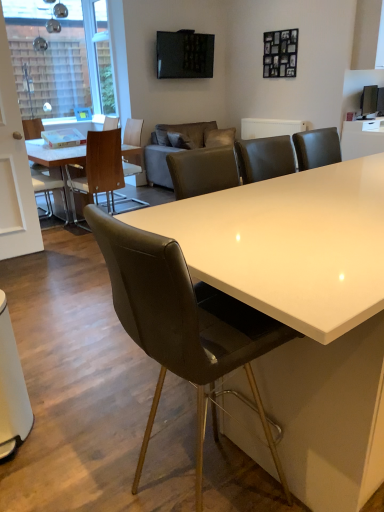
Question: Does woodenchair at left, arranged as the 1th chair when viewed from the back, lie in front of white leather chair at left, arranged as the 2th chair when viewed from the back?

Choices:
 (A) no
 (B) yes

Answer: (A)

Question: Is woodenchair at left, arranged as the 1th chair when viewed from the back, shorter than white leather chair at left, arranged as the 2th chair when viewed from the back?

Choices:
 (A) no
 (B) yes

Answer: (A)

Question: Can you confirm if woodenchair at left, arranged as the 1th chair when viewed from the back, is wider than white leather chair at left, arranged as the 2th chair when viewed from the back?

Choices:
 (A) yes
 (B) no

Answer: (A)

Question: From the image's perspective, does woodenchair at left, arranged as the 1th chair when viewed from the back, appear higher than white leather chair at left, which appears as the third chair when viewed from the front?

Choices:
 (A) yes
 (B) no

Answer: (A)

Question: Is woodenchair at left, arranged as the 1th chair when viewed from the back, at the left side of white leather chair at left, arranged as the 2th chair when viewed from the back?

Choices:
 (A) no
 (B) yes

Answer: (A)

Question: Is leather at center, the 1th chair from the front, inside the boundaries of white glossy table at upper right, which is the 1th table from right to left, or outside?

Choices:
 (A) inside
 (B) outside

Answer: (B)

Question: Considering the positions of leather at center, placed as the fourth chair when sorted from back to front, and white glossy table at upper right, which is the second table in left-to-right order, in the image, is leather at center, placed as the fourth chair when sorted from back to front, taller or shorter than white glossy table at upper right, which is the second table in left-to-right order,?

Choices:
 (A) tall
 (B) short

Answer: (A)

Question: Considering their positions, is leather at center, the 1th chair from the front, located in front of or behind white glossy table at upper right, which is the second table in left-to-right order?

Choices:
 (A) front
 (B) behind

Answer: (A)

Question: Looking at their shapes, would you say leather at center, the 1th chair from the front, is wider or thinner than white glossy table at upper right, which is the 1th table from right to left?

Choices:
 (A) wide
 (B) thin

Answer: (B)

Question: Is matte gray couch at center in front of or behind wooden chair at left, the second chair viewed from the front, in the image?

Choices:
 (A) behind
 (B) front

Answer: (A)

Question: Based on their sizes in the image, would you say matte gray couch at center is bigger or smaller than wooden chair at left, the 3th chair positioned from the back?

Choices:
 (A) big
 (B) small

Answer: (A)

Question: From a real-world perspective, is matte gray couch at center above or below wooden chair at left, the 3th chair positioned from the back?

Choices:
 (A) below
 (B) above

Answer: (A)

Question: Is matte gray couch at center inside or outside of wooden chair at left, the 3th chair positioned from the back?

Choices:
 (A) outside
 (B) inside

Answer: (A)

Question: Is wooden chair at left, the 3th chair positioned from the back, spatially inside white glossy door at left, or outside of it?

Choices:
 (A) outside
 (B) inside

Answer: (A)

Question: Based on their sizes in the image, would you say wooden chair at left, the second chair viewed from the front, is bigger or smaller than white glossy door at left?

Choices:
 (A) small
 (B) big

Answer: (B)